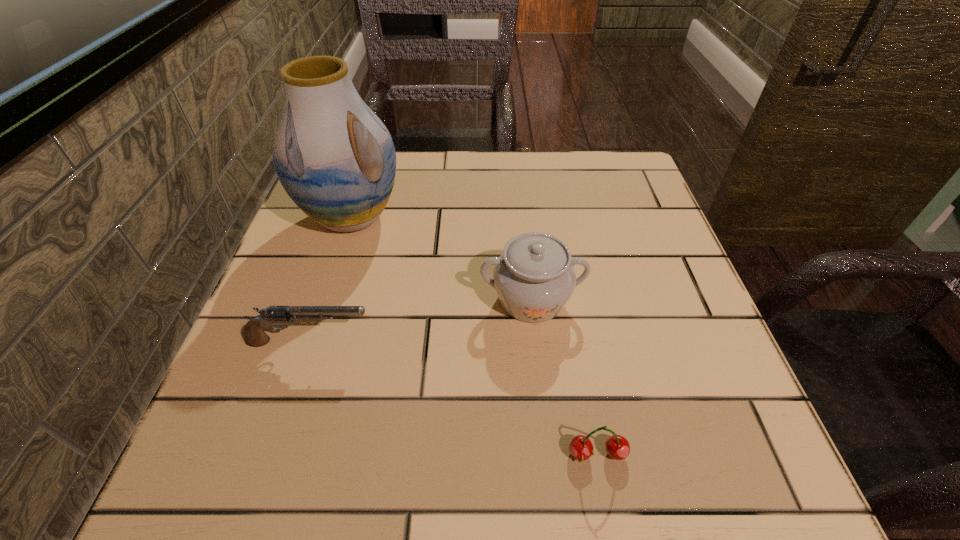
The image size is (960, 540). I want to click on object that is at the near edge, so click(581, 448).

Where is `vase that is at the left edge`? This screenshot has width=960, height=540. vase that is at the left edge is located at coordinates (334, 157).

Image resolution: width=960 pixels, height=540 pixels. I want to click on gun located in the left edge section of the desktop, so click(x=254, y=335).

This screenshot has width=960, height=540. I want to click on object that is at the far left corner, so click(x=334, y=157).

The width and height of the screenshot is (960, 540). Find the location of `vacant space at the far edge`. vacant space at the far edge is located at coordinates (412, 150).

This screenshot has width=960, height=540. In the image, there is a desktop. In order to click on blank space at the near edge in this screenshot , I will do `click(320, 474)`.

Locate an element on the screen. The height and width of the screenshot is (540, 960). vacant region at the left edge is located at coordinates (300, 222).

In the image, there is a desktop. Where is `vacant space at the right edge`? This screenshot has height=540, width=960. vacant space at the right edge is located at coordinates (609, 244).

Find the location of a particular element. The height and width of the screenshot is (540, 960). free space at the far right corner of the desktop is located at coordinates (625, 151).

Locate an element on the screen. vacant space at the near right corner is located at coordinates (681, 440).